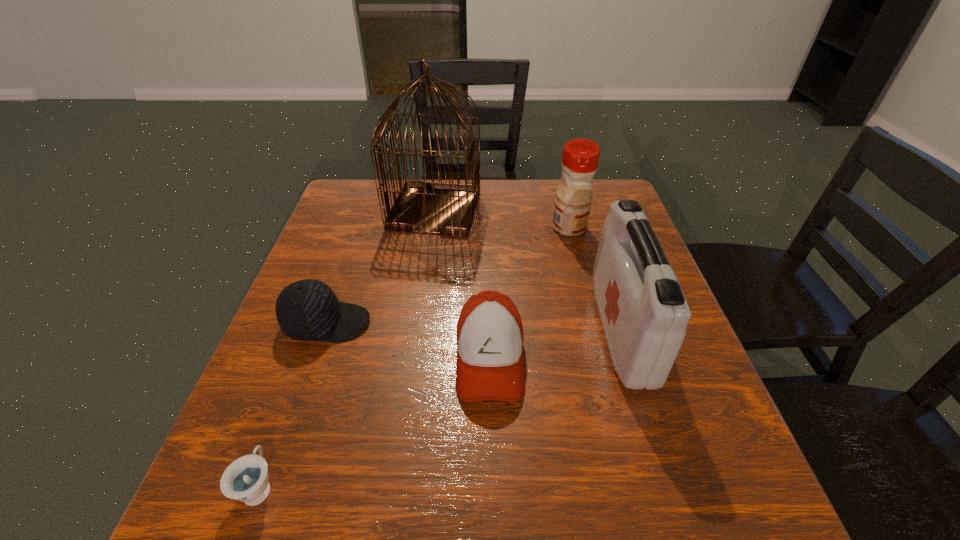
Locate an element on the screen. free space located 0.390m on the front side of the first-aid kit is located at coordinates (416, 331).

Locate an element on the screen. This screenshot has height=540, width=960. vacant space located on the front side of the first-aid kit is located at coordinates (482, 331).

Locate an element on the screen. The width and height of the screenshot is (960, 540). vacant space located 0.110m on the front side of the first-aid kit is located at coordinates (549, 331).

Find the location of a particular element. This screenshot has width=960, height=540. free space located on the front-facing side of the right baseball cap is located at coordinates (492, 438).

I want to click on vacant space located 0.050m at the front of the shorter baseball cap where the brim is located, so coord(394,323).

Image resolution: width=960 pixels, height=540 pixels. In order to click on vacant space located 0.180m on the side of the teacup with the handle in this screenshot , I will do (x=302, y=369).

Where is `vacant area located on the side of the teacup with the handle`? vacant area located on the side of the teacup with the handle is located at coordinates (329, 293).

Identify the location of vacant space located on the side of the teacup with the handle. This screenshot has width=960, height=540. (325, 306).

Locate an element on the screen. birdcage located at the far edge is located at coordinates (421, 206).

Find the location of a particular element. condiment located in the far edge section of the desktop is located at coordinates (580, 157).